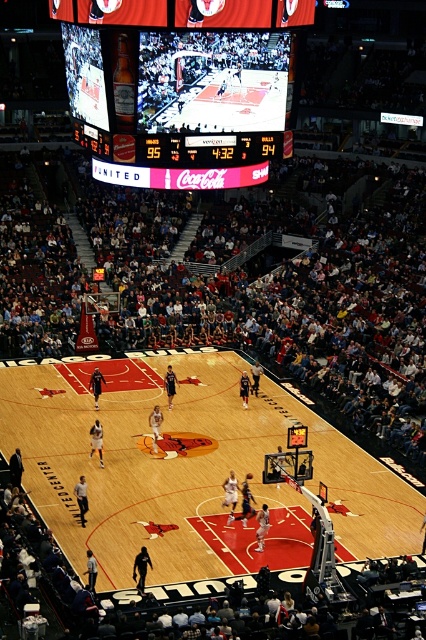
In the scene shown: You are a photographer standing at the baseline of the court. You want to take a photo that includes both point [238,436] and point [187,80]. Considering their positions, which point will appear closer to the front of your photo?

Point [238,436] is further to the camera than point [187,80], so in the photo, point [187,80] will appear closer to the front of the photo.

You are a photographer standing at the edge of the court. You want to capture a photo that includes both the wooden polished basketball court at center and the matte digital scoreboard at upper center. Which object should you position closer to the camera to ensure both are in frame without cropping?

To include both the wooden polished basketball court at center and the matte digital scoreboard at upper center in the photo without cropping, you should position the wooden polished basketball court at center closer to the camera since it is wider than the matte digital scoreboard at upper center.

Consider the image. You are a basketball coach analyzing the game. You notice the wooden polished basketball court at center and the shiny orange basketball at center. Which object takes up more space in the image?

The wooden polished basketball court at center takes up more space in the image because it has a larger size compared to the shiny orange basketball at center.